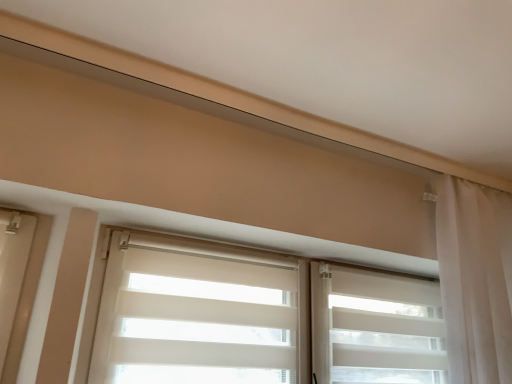
Question: From the image's perspective, is white matte/soft roller-shutter at center above white sheer curtain at right?

Choices:
 (A) yes
 (B) no

Answer: (B)

Question: Is white matte/soft roller-shutter at center outside of white sheer curtain at right?

Choices:
 (A) no
 (B) yes

Answer: (B)

Question: Can you confirm if white matte/soft roller-shutter at center is smaller than white sheer curtain at right?

Choices:
 (A) yes
 (B) no

Answer: (A)

Question: Is white matte/soft roller-shutter at center to the right of white sheer curtain at right from the viewer's perspective?

Choices:
 (A) yes
 (B) no

Answer: (B)

Question: Considering the relative sizes of white matte/soft roller-shutter at center and white sheer curtain at right in the image provided, is white matte/soft roller-shutter at center wider than white sheer curtain at right?

Choices:
 (A) no
 (B) yes

Answer: (A)

Question: Considering the relative sizes of white matte/soft roller-shutter at center and white sheer curtain at right in the image provided, is white matte/soft roller-shutter at center thinner than white sheer curtain at right?

Choices:
 (A) no
 (B) yes

Answer: (B)

Question: Is white matte/soft roller-shutter at center closer to camera compared to white sheer curtain at center?

Choices:
 (A) no
 (B) yes

Answer: (A)

Question: Can you see white matte/soft roller-shutter at center touching white sheer curtain at center?

Choices:
 (A) yes
 (B) no

Answer: (B)

Question: Is white sheer curtain at center located within white matte/soft roller-shutter at center?

Choices:
 (A) no
 (B) yes

Answer: (B)

Question: Can you confirm if white matte/soft roller-shutter at center is taller than white sheer curtain at center?

Choices:
 (A) yes
 (B) no

Answer: (B)

Question: Can you confirm if white matte/soft roller-shutter at center is shorter than white sheer curtain at center?

Choices:
 (A) yes
 (B) no

Answer: (A)

Question: From the image's perspective, is white matte/soft roller-shutter at center located beneath white sheer curtain at center?

Choices:
 (A) yes
 (B) no

Answer: (A)

Question: From a real-world perspective, is white sheer curtain at right beneath white sheer curtain at center?

Choices:
 (A) yes
 (B) no

Answer: (B)